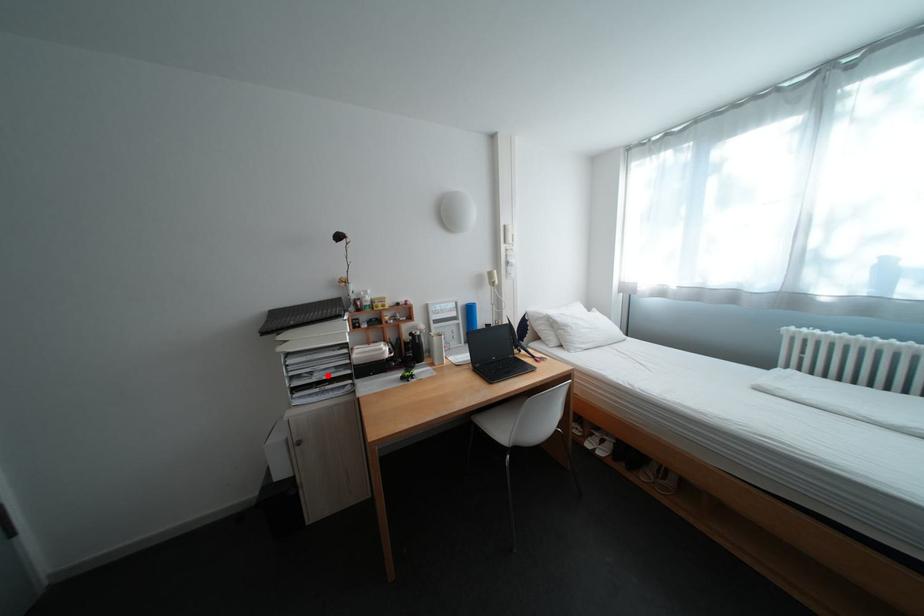
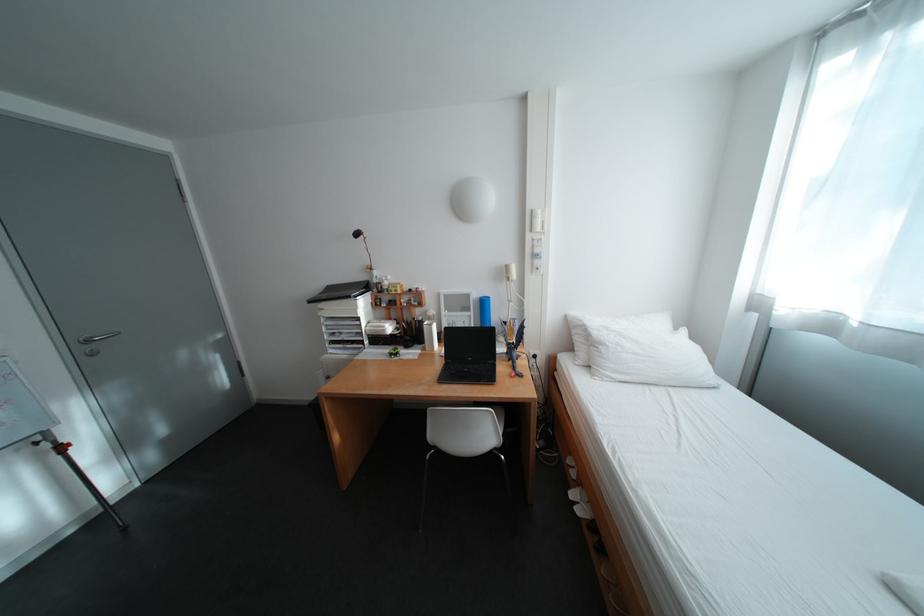
Locate, in the second image, the point that corresponds to the highlighted location in the first image.

(355, 336)